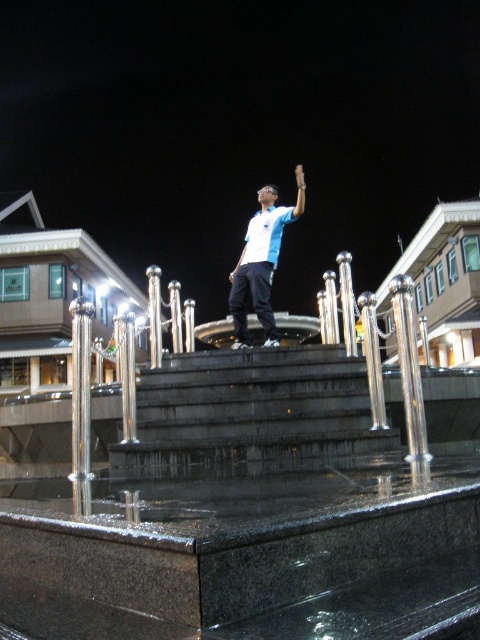
Consider the image. You are a drone operator trying to navigate between two points in the image. The first point is point (x=233, y=358) and the second point is point (x=260, y=278). Which point is closer to you?

Point (x=233, y=358) is closer to the viewer than point (x=260, y=278).

You are a photographer trying to capture a shot of the matte blue shirt at center and the black granite stairs at center in the same frame. Based on their positions, which object should you focus on first to ensure both are in the frame?

You should focus on the matte blue shirt at center first because the black granite stairs at center are to the left of it, so centering the shirt will naturally include the stairs in the frame to its left.

You are a delivery drone flying at an altitude of 10 meters above the black granite stairs at center. You need to deliver a package to the matte blue shirt at center. Can you safely descend to the required altitude to drop the package without hitting the stairs?

The black granite stairs at center is 11.20 meters away from matte blue shirt at center. Since the drone is flying at 10 meters above the stairs, it can safely descend to the required altitude to drop the package as the distance between them allows for a safe approach.